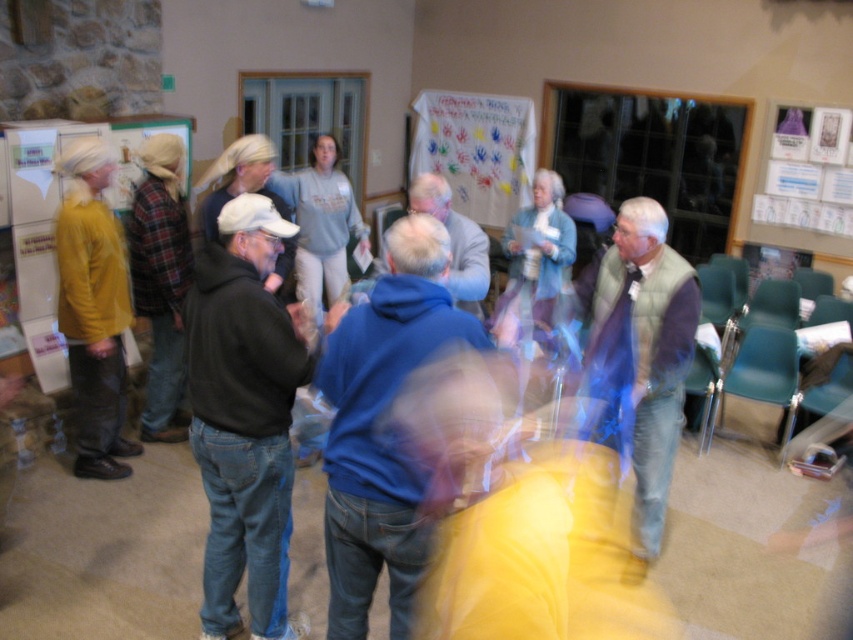
You are organizing a coat rack in the community center and need to hang the velvet yellow sweater at left and the white paperboard at upper right. Which item can be placed on a thinner hanger?

The velvet yellow sweater at left is thinner than the white paperboard at upper right, so the velvet yellow sweater at left can be placed on a thinner hanger.

You are organizing a charity event and need to decide whether the velvet yellow sweater at left can be displayed on the white paperboard at upper right. Based on their sizes, will the sweater fit on the paperboard?

The velvet yellow sweater at left has a larger size compared to the white paperboard at upper right, so the sweater will not fit on the paperboard.

You are standing in the community center and see both the blue fleece jacket at center and the light blue vest at center. Which one is nearer to you?

The blue fleece jacket at center is closer to the viewer than the light blue vest at center.